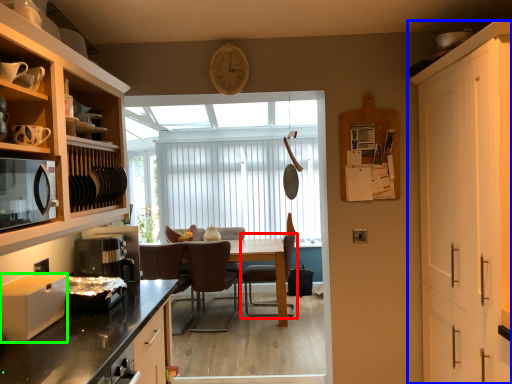
Question: Considering the real-world distances, which object is closest to chair (highlighted by a red box)? cabinetry (highlighted by a blue box) or appliance (highlighted by a green box).

Choices:
 (A) cabinetry
 (B) appliance

Answer: (A)